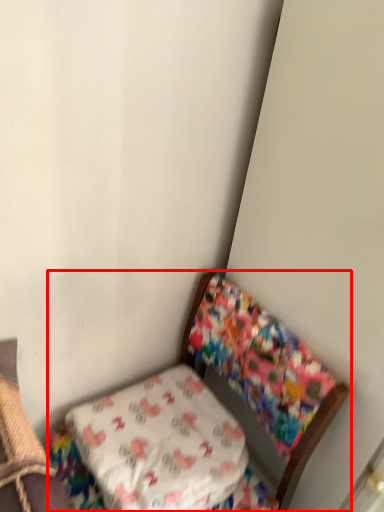
Question: Where is furniture (annotated by the red box) located in relation to pillow in the image?

Choices:
 (A) left
 (B) right

Answer: (B)